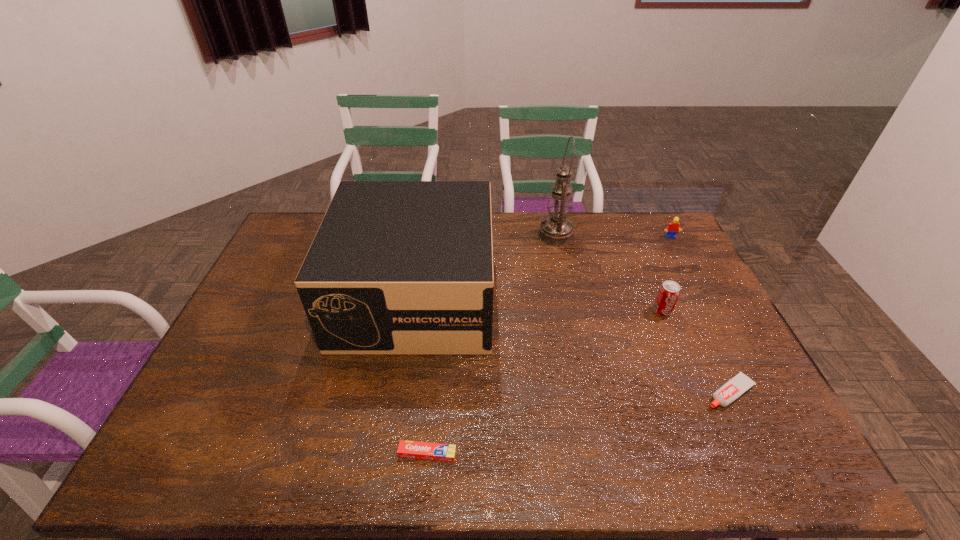
At what (x,y) coordinates should I click in order to perform the action: click on oil lamp. Please return your answer as a coordinate pair (x, y). The height and width of the screenshot is (540, 960). Looking at the image, I should click on (556, 230).

I want to click on the tallest object, so click(556, 230).

Identify the location of the fifth shortest object. (396, 267).

Where is `the fourth shortest object`? The width and height of the screenshot is (960, 540). the fourth shortest object is located at coordinates (668, 294).

Locate an element on the screen. Lego is located at coordinates (673, 227).

This screenshot has height=540, width=960. I want to click on the taller toothpaste, so click(734, 388).

What are the coordinates of `the fifth tallest object` in the screenshot? It's located at (734, 388).

Locate an element on the screen. The height and width of the screenshot is (540, 960). the nearest object is located at coordinates (407, 449).

Identify the location of the shortest object. (407, 449).

Where is `free spot located on the front of the tallest object`? free spot located on the front of the tallest object is located at coordinates (566, 285).